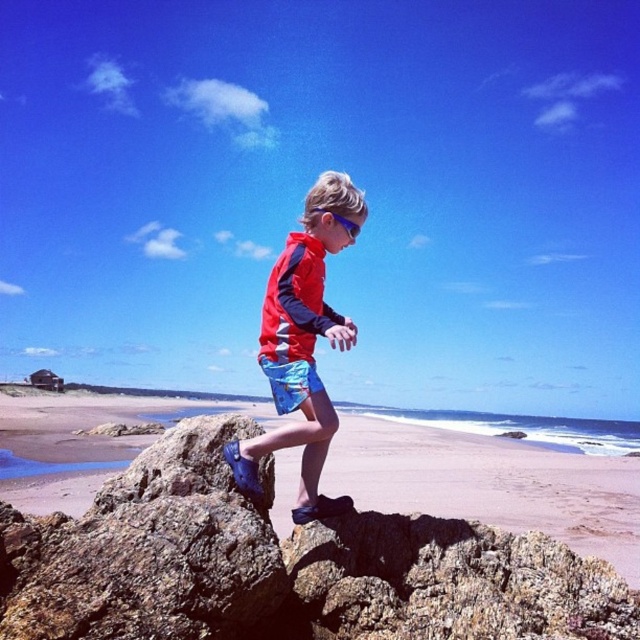
What do you see at coordinates (301, 344) in the screenshot?
I see `matte red rash guard at center` at bounding box center [301, 344].

Identify the location of matte red rash guard at center. (301, 344).

Measure the distance between matte red rash guard at center and camera.

matte red rash guard at center and camera are 26.38 meters apart.

Image resolution: width=640 pixels, height=640 pixels. I want to click on matte red rash guard at center, so click(301, 344).

Identify the location of matte red rash guard at center. (301, 344).

Does matte red rash guard at center have a smaller size compared to blue printed shorts at center?

Incorrect, matte red rash guard at center is not smaller in size than blue printed shorts at center.

In the scene shown: Measure the distance between point (305, 218) and camera.

36.71 meters

Where is `matte red rash guard at center`? The width and height of the screenshot is (640, 640). matte red rash guard at center is located at coordinates (301, 344).

Is point (400, 472) farther from camera compared to point (289, 400)?

That is True.

Is point (298, 467) positioned behind point (291, 387)?

Yes.

In order to click on smooth sand beach at center in this screenshot , I will do `click(490, 483)`.